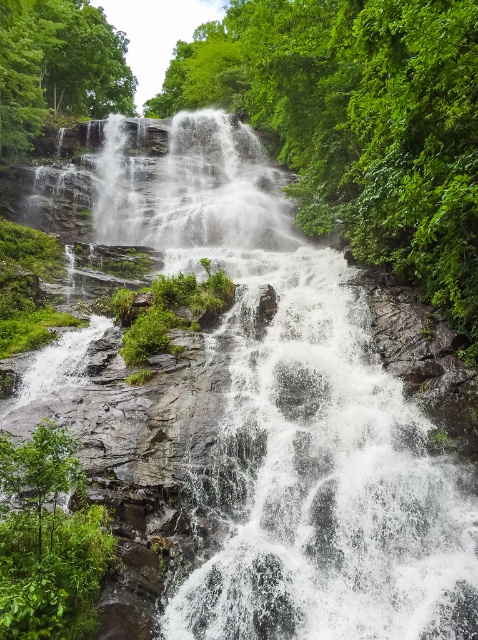
Does white frothy water at center have a larger size compared to green leafy tree at upper left?

Actually, white frothy water at center might be smaller than green leafy tree at upper left.

Which is more to the right, white frothy water at center or green leafy tree at upper left?

white frothy water at center

You are a GUI agent. You are given a task and a screenshot of the screen. Output one action in this format:
    pyautogui.click(x=<x>, y=<y>)
    Task: Click on the white frothy water at center
    This screenshot has width=478, height=640.
    Given the screenshot: What is the action you would take?
    pyautogui.click(x=192, y=188)